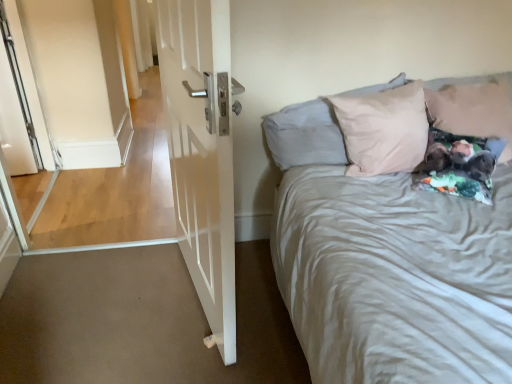
Locate an element on the screen. This screenshot has height=384, width=512. vacant space in white glossy door at left (from a real-world perspective) is located at coordinates (188, 297).